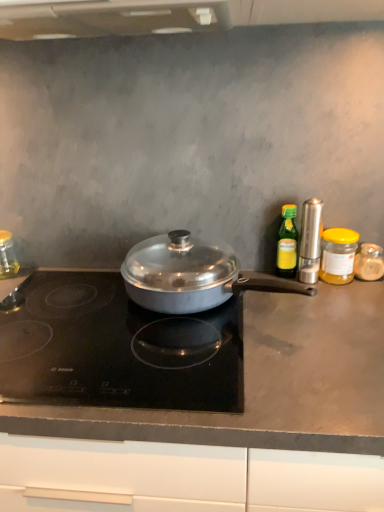
The image size is (384, 512). What are the coordinates of `vacant area that is in front of translucent glass jar at right, placed as the sixth kitchen appliance when sorted from left to right` in the screenshot? It's located at (359, 305).